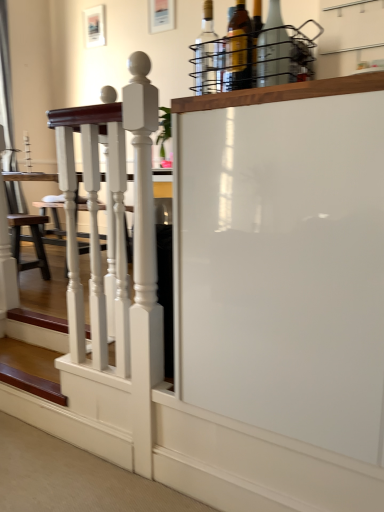
Question: Which direction should I rotate to look at matte glass bottle at upper center, the 2th bottle positioned from the right?

Choices:
 (A) left
 (B) right

Answer: (B)

Question: Which direction should I rotate to face clear glass bottle at upper center, the fifth bottle in the left-to-right sequence, — up or down?

Choices:
 (A) down
 (B) up

Answer: (B)

Question: Is brown leather stool at lower left facing towards white glossy screen door at center?

Choices:
 (A) yes
 (B) no

Answer: (B)

Question: From a real-world perspective, does brown leather stool at lower left stand above white glossy screen door at center?

Choices:
 (A) yes
 (B) no

Answer: (B)

Question: From the image's perspective, would you say brown leather stool at lower left is shown under white glossy screen door at center?

Choices:
 (A) yes
 (B) no

Answer: (A)

Question: Is brown leather stool at lower left next to white glossy screen door at center and touching it?

Choices:
 (A) no
 (B) yes

Answer: (A)

Question: Is brown leather stool at lower left thinner than white glossy screen door at center?

Choices:
 (A) yes
 (B) no

Answer: (A)

Question: Is brown leather stool at lower left not inside white glossy screen door at center?

Choices:
 (A) no
 (B) yes

Answer: (B)

Question: Does translucent glass bottle at upper center, which appears as the 3th bottle when viewed from the right, come in front of wooden stairs at lower left?

Choices:
 (A) yes
 (B) no

Answer: (A)

Question: Can you confirm if translucent glass bottle at upper center, which appears as the 3th bottle when viewed from the left, is thinner than wooden stairs at lower left?

Choices:
 (A) no
 (B) yes

Answer: (B)

Question: Is translucent glass bottle at upper center, which appears as the 3th bottle when viewed from the left, behind wooden stairs at lower left?

Choices:
 (A) no
 (B) yes

Answer: (A)

Question: Considering the relative positions of translucent glass bottle at upper center, which appears as the 3th bottle when viewed from the right, and wooden stairs at lower left in the image provided, is translucent glass bottle at upper center, which appears as the 3th bottle when viewed from the right, to the right of wooden stairs at lower left from the viewer's perspective?

Choices:
 (A) yes
 (B) no

Answer: (A)

Question: From the image's perspective, is translucent glass bottle at upper center, which appears as the 3th bottle when viewed from the left, above wooden stairs at lower left?

Choices:
 (A) yes
 (B) no

Answer: (A)

Question: Considering the relative sizes of translucent glass bottle at upper center, which appears as the 3th bottle when viewed from the left, and wooden stairs at lower left in the image provided, is translucent glass bottle at upper center, which appears as the 3th bottle when viewed from the left, taller than wooden stairs at lower left?

Choices:
 (A) no
 (B) yes

Answer: (B)

Question: Considering the relative sizes of matte glass bottle at upper center, the 2th bottle positioned from the right, and wooden stairs at lower left in the image provided, is matte glass bottle at upper center, the 2th bottle positioned from the right, bigger than wooden stairs at lower left?

Choices:
 (A) yes
 (B) no

Answer: (B)